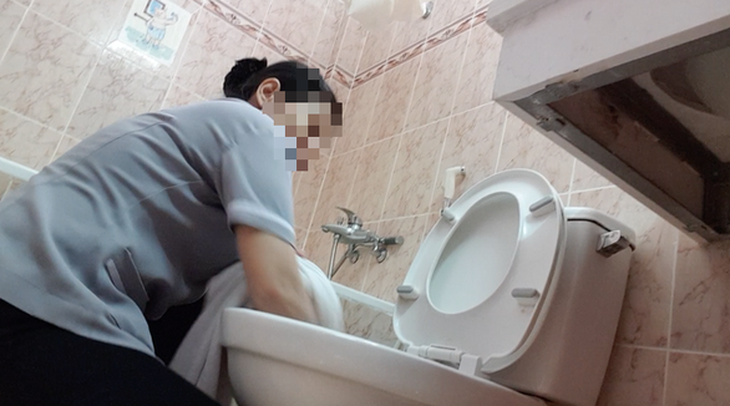
Where is `towel`? towel is located at coordinates (195, 347).